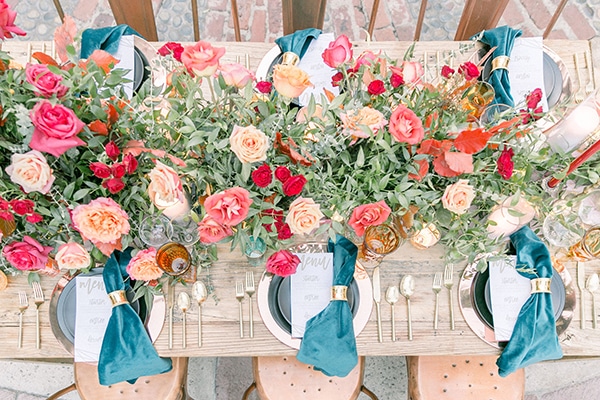
I want to click on teal napkins, so click(122, 318), click(337, 321), click(538, 317), click(501, 80), click(294, 43), click(98, 44).